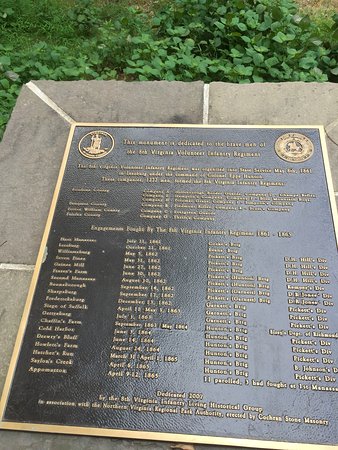
In order to click on gold border in this screenshot , I will do point(161,435).